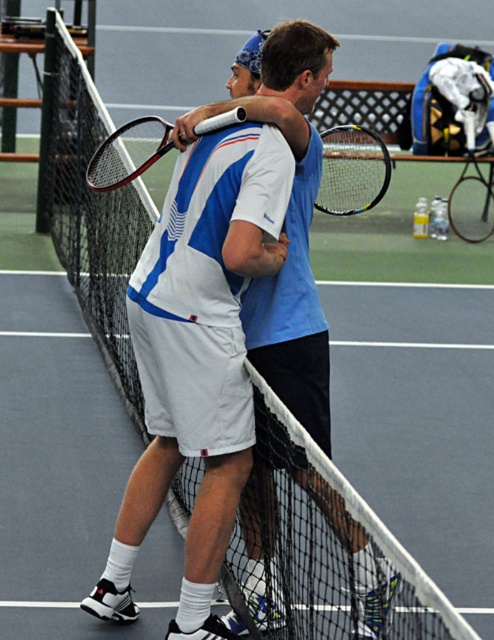
You are a tennis coach observing a training session. You notice two rackets on the court. Which racket is positioned higher up, the black rubber tennis racket at center or the matte black tennis racket at upper center?

The black rubber tennis racket at center is above the matte black tennis racket at upper center, so the black rubber tennis racket at center is positioned higher up.